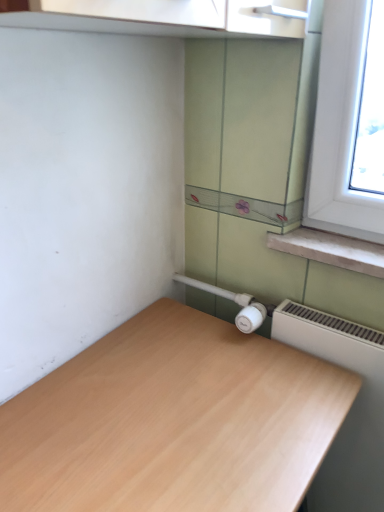
The image size is (384, 512). I want to click on free space above light wood table at lower right (from a real-world perspective), so click(x=183, y=402).